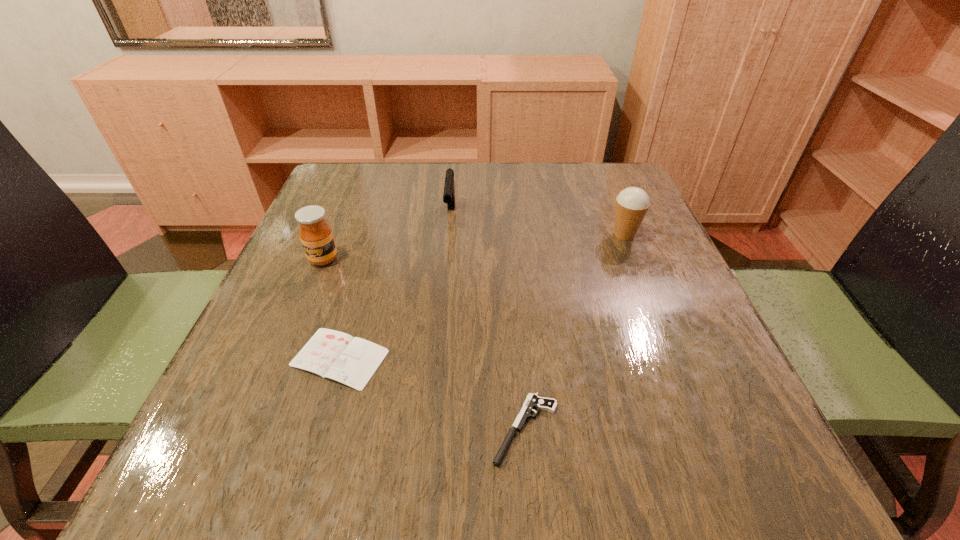
Where is `free space between the left pistol and the nearer pistol`? free space between the left pistol and the nearer pistol is located at coordinates (488, 322).

This screenshot has width=960, height=540. In order to click on free space between the diary and the nearest object in this screenshot , I will do `click(433, 394)`.

The image size is (960, 540). What are the coordinates of `unoccupied position between the fourth farthest object and the right pistol` in the screenshot? It's located at (433, 394).

Locate an element on the screen. This screenshot has width=960, height=540. free space between the rightmost object and the shortest object is located at coordinates (482, 296).

At what (x,y) coordinates should I click in order to perform the action: click on free space between the nearest object and the third tallest object. Please return your answer as a coordinate pair (x, y). The width and height of the screenshot is (960, 540). Looking at the image, I should click on (488, 322).

Locate an element on the screen. Image resolution: width=960 pixels, height=540 pixels. free space between the diary and the third farthest object is located at coordinates (331, 308).

The height and width of the screenshot is (540, 960). What are the coordinates of `free space between the second shortest object and the shortest object` in the screenshot? It's located at (433, 394).

The height and width of the screenshot is (540, 960). I want to click on object that is the third closest to the icecream, so (352, 361).

Identify which object is located as the second nearest to the diary. Please provide its 2D coordinates. Your answer should be formatted as a tuple, i.e. [(x, y)], where the tuple contains the x and y coordinates of a point satisfying the conditions above.

[(532, 401)]

Where is `vacant area in the image that satisfies the following two spatial constraints: 1. at the barrel of the third shortest object; 2. on the left side of the rightmost object`? vacant area in the image that satisfies the following two spatial constraints: 1. at the barrel of the third shortest object; 2. on the left side of the rightmost object is located at coordinates point(449,235).